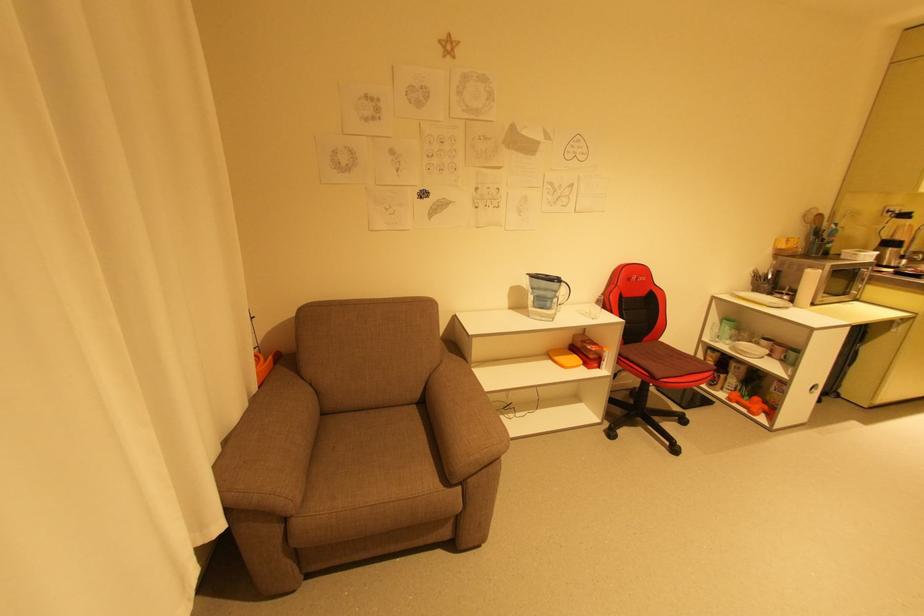
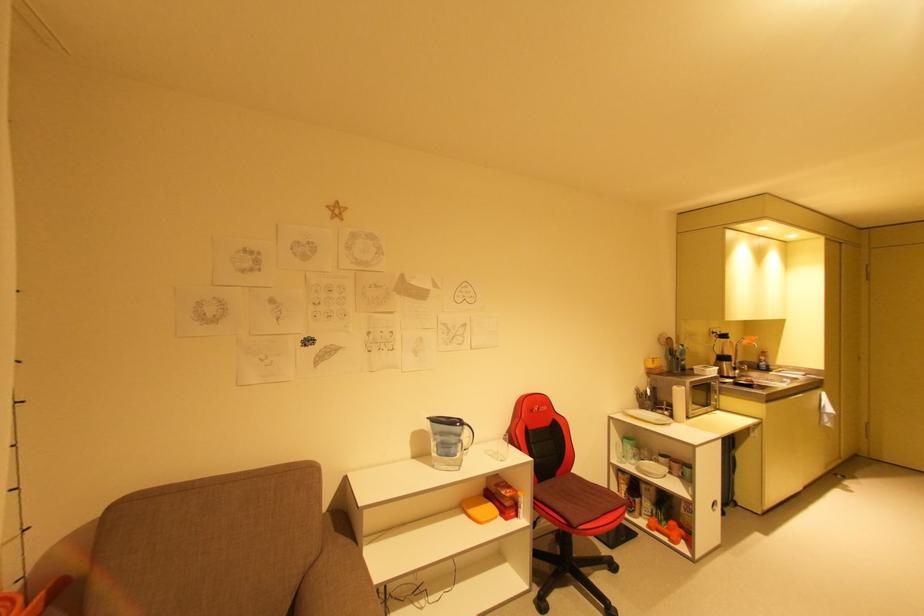
Find the pixel in the second image that matches the point at 816,392 in the first image.

(718, 511)